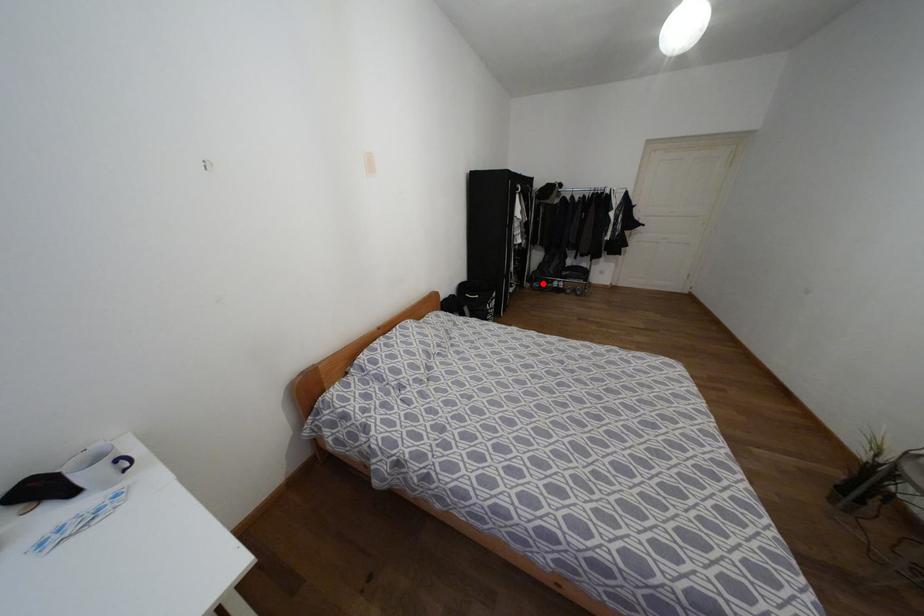
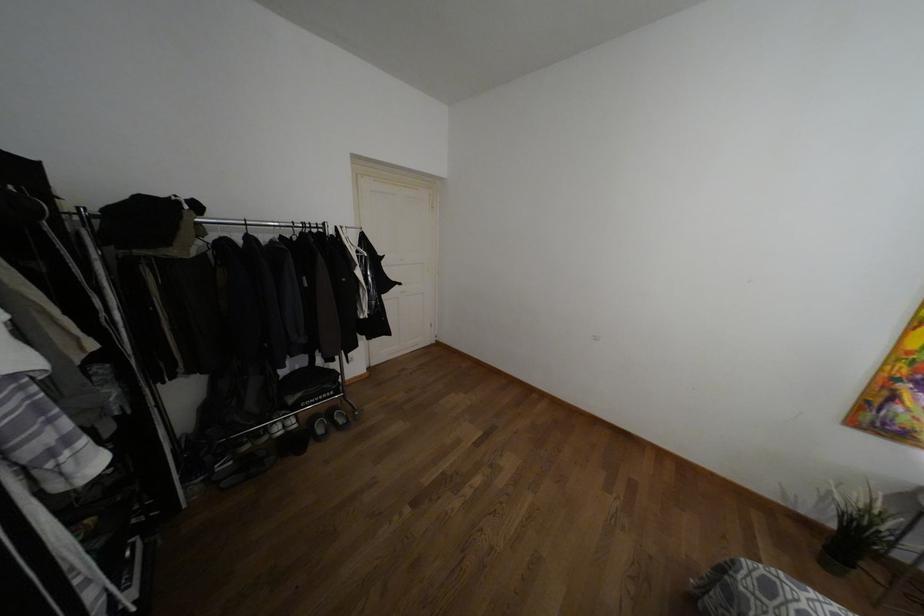
Question: A red point is marked in image1. In image2, is the corresponding 3D point closer to the camera or farther? Reply with the corresponding letter.

Choices:
 (A) The corresponding 3D point is closer.
 (B) The corresponding 3D point is farther.

Answer: (A)